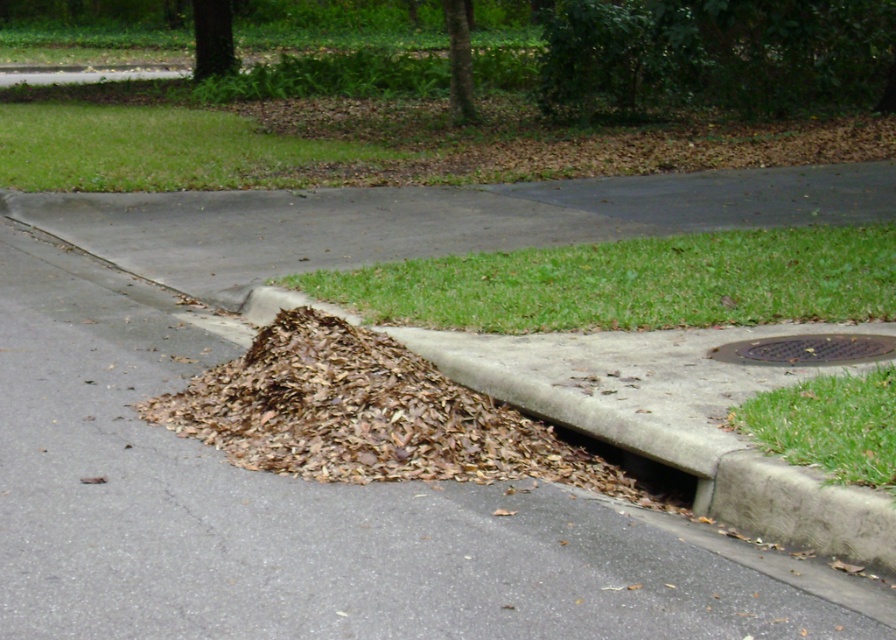
You are standing at the curb looking at the green grass at center and the green grass at lower right. Which area of green grass is positioned to the right side when comparing the two?

The green grass at center is positioned to the right of the green grass at lower right.

You are standing on the suburban street corner and want to pick up the leaves from the pile. The pile is located at point [55,371]. If you can reach 25 feet in front of you, can you reach the pile without moving?

The point [55,371] is 26.89 feet from the viewer, which is beyond the 25 feet reach. Therefore, you cannot reach the pile without moving closer.